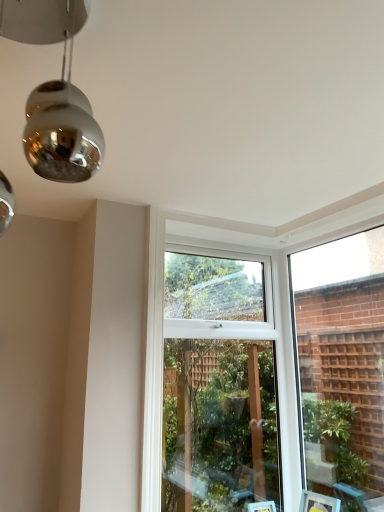
Question: Looking at the image, does clear glass window at center seem bigger or smaller compared to clear glass window at upper right?

Choices:
 (A) small
 (B) big

Answer: (B)

Question: Choose the correct answer: Is clear glass window at center inside clear glass window at upper right or outside it?

Choices:
 (A) inside
 (B) outside

Answer: (B)

Question: Is clear glass window at center taller or shorter than clear glass window at upper right?

Choices:
 (A) short
 (B) tall

Answer: (B)

Question: Is point (306, 410) positioned closer to the camera than point (216, 509)?

Choices:
 (A) closer
 (B) farther

Answer: (B)

Question: Based on their positions, is clear glass window at upper right located to the left or right of clear glass window at center?

Choices:
 (A) right
 (B) left

Answer: (A)

Question: Looking at the image, does clear glass window at upper right seem bigger or smaller compared to clear glass window at center?

Choices:
 (A) small
 (B) big

Answer: (A)

Question: From the image's perspective, is clear glass window at upper right located above or below clear glass window at center?

Choices:
 (A) above
 (B) below

Answer: (A)